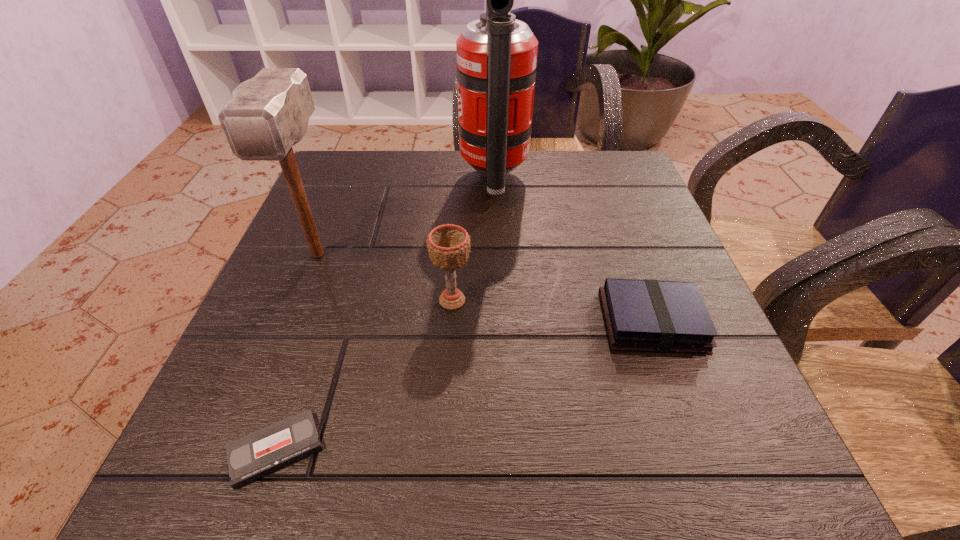
Find the location of a particular element. The height and width of the screenshot is (540, 960). object identified as the closest to the farthest object is located at coordinates (448, 245).

Where is `free space that satisfies the following two spatial constraints: 1. on the striking face of the fourth shortest object; 2. on the left side of the chalice`? The width and height of the screenshot is (960, 540). free space that satisfies the following two spatial constraints: 1. on the striking face of the fourth shortest object; 2. on the left side of the chalice is located at coordinates (300, 301).

What are the coordinates of `free space that satisfies the following two spatial constraints: 1. on the front label side of the book; 2. on the right side of the tallest object` in the screenshot? It's located at (500, 322).

I want to click on free space in the image that satisfies the following two spatial constraints: 1. on the back side of the rightmost object; 2. on the front label side of the fire extinguisher, so click(600, 180).

Locate an element on the screen. The image size is (960, 540). blank area in the image that satisfies the following two spatial constraints: 1. on the front label side of the farthest object; 2. on the right side of the rightmost object is located at coordinates (500, 322).

Locate an element on the screen. The height and width of the screenshot is (540, 960). vacant area that satisfies the following two spatial constraints: 1. on the back side of the third tallest object; 2. on the right side of the nearest object is located at coordinates (x=326, y=301).

Locate an element on the screen. The width and height of the screenshot is (960, 540). vacant space that satisfies the following two spatial constraints: 1. on the back side of the nearest object; 2. on the left side of the book is located at coordinates (320, 322).